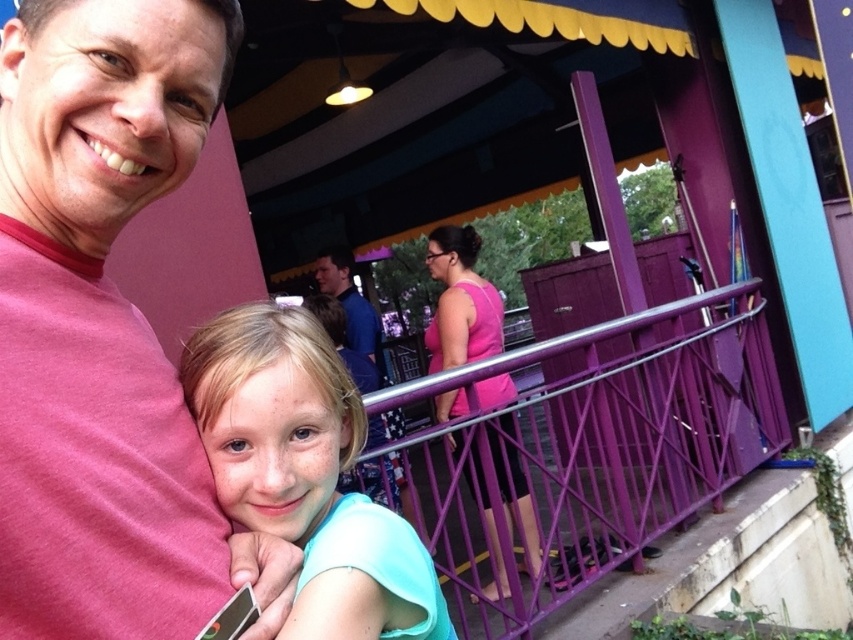
Does purple metallic railing at center appear under light blue fabric at center?

Yes.

Is point (692, 362) less distant than point (236, 339)?

No, it is not.

Is point (416, 445) farther from camera compared to point (425, 557)?

That is True.

Image resolution: width=853 pixels, height=640 pixels. I want to click on purple metallic railing at center, so click(x=599, y=444).

Between point (453, 531) and point (430, 232), which one is positioned behind?

Point (430, 232)

Which of these two, purple metallic railing at center or pink fabric dress at center, stands taller?

Standing taller between the two is purple metallic railing at center.

Where is `purple metallic railing at center`? The height and width of the screenshot is (640, 853). purple metallic railing at center is located at coordinates tap(599, 444).

Is light blue fabric at center bigger than pink fabric dress at center?

No, light blue fabric at center is not bigger than pink fabric dress at center.

Which is in front, point (395, 518) or point (480, 394)?

Point (395, 518) is more forward.

Who is more distant from viewer, [270,476] or [434,230]?

Positioned behind is point [434,230].

Find the location of `light blue fabric at center`. light blue fabric at center is located at coordinates (305, 474).